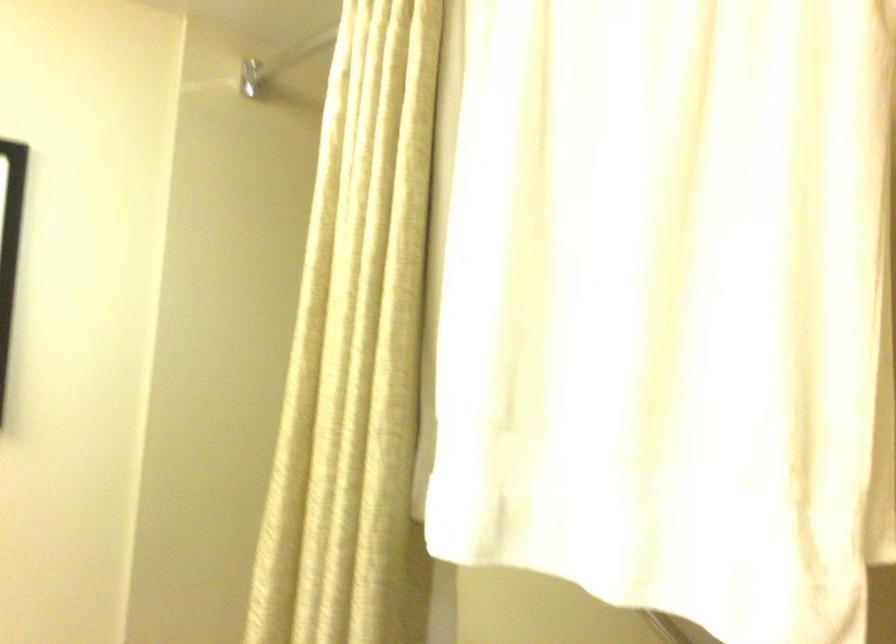
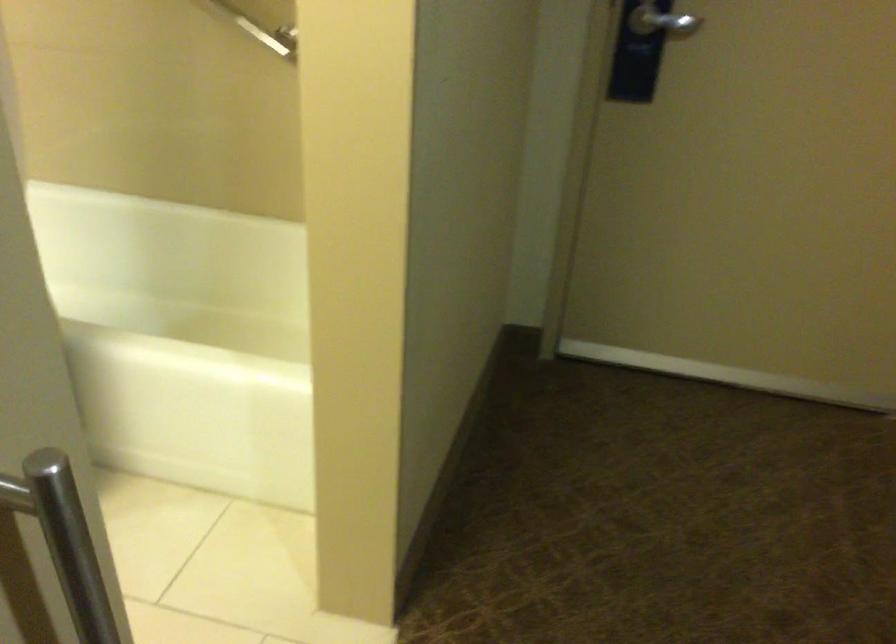
In the scene shown: The images are taken continuously from a first-person perspective. In which direction is your viewpoint rotating?

The camera rotated toward right-down.